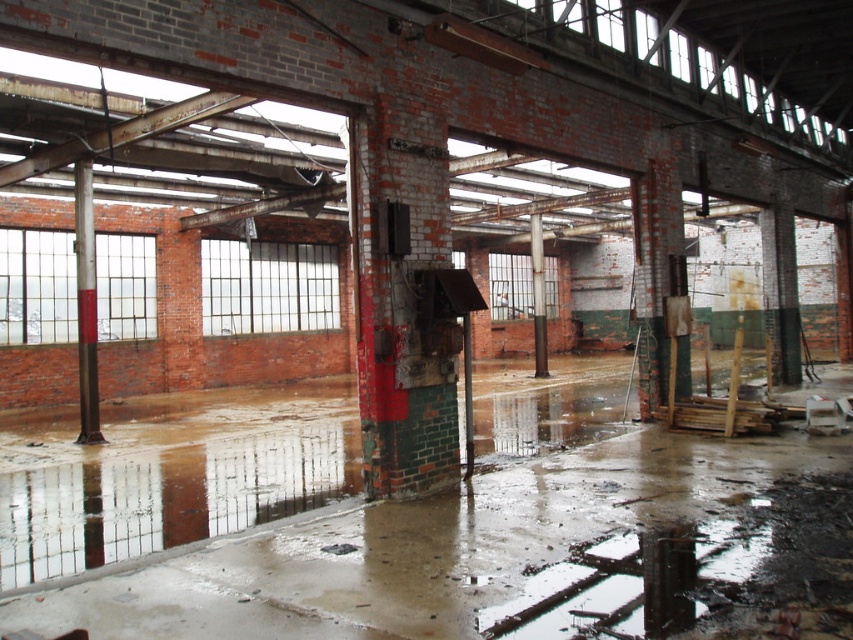
You are a maintenance worker inspecting the industrial space. You see a rusty metal pillar at center and a brown wood pillar at center. Which pillar is located to the left when facing the pillars from the entrance?

The rusty metal pillar at center is positioned on the left side of the brown wood pillar at center, so it is located to the left when facing the pillars from the entrance.

You are a maintenance worker inspecting the warehouse. You notice two structural supports in the image. Which one is shorter between the rusty metal pillar at center and the red painted steel pole at left?

The rusty metal pillar at center is shorter than the red painted steel pole at left.